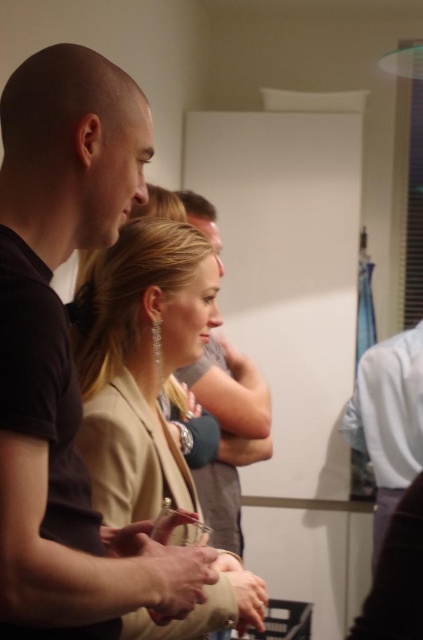
Is black matte shirt at left wider than satin beige blazer at center?

No, black matte shirt at left is not wider than satin beige blazer at center.

The image size is (423, 640). Describe the element at coordinates (65, 353) in the screenshot. I see `black matte shirt at left` at that location.

The image size is (423, 640). I want to click on black matte shirt at left, so click(65, 353).

The image size is (423, 640). Find the location of `black matte shirt at left`. black matte shirt at left is located at coordinates (65, 353).